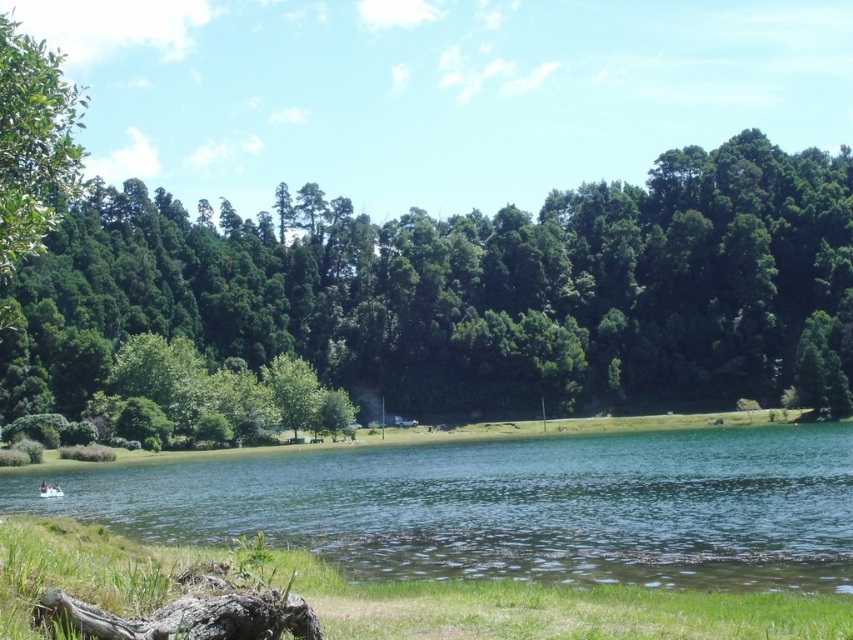
Question: Does charcoal gray bark log at lower left appear on the left side of white plastic boat at lower left?

Choices:
 (A) yes
 (B) no

Answer: (B)

Question: Estimate the real-world distances between objects in this image. Which object is closer to the green leafy tree at center?

Choices:
 (A) green liquid water at center
 (B) white plastic boat at lower left
 (C) charcoal gray bark log at lower left
 (D) green grass at lower center

Answer: (A)

Question: Which object is closer to the camera taking this photo?

Choices:
 (A) green liquid water at center
 (B) charcoal gray bark log at lower left
 (C) green grass at lower center
 (D) white plastic boat at lower left

Answer: (C)

Question: Which of the following is the farthest from the observer?

Choices:
 (A) (607, 282)
 (B) (466, 445)

Answer: (A)

Question: Does green leafy tree at center appear on the left side of white plastic boat at lower left?

Choices:
 (A) no
 (B) yes

Answer: (A)

Question: Can you confirm if green grass at lower center is thinner than white plastic boat at lower left?

Choices:
 (A) yes
 (B) no

Answer: (B)